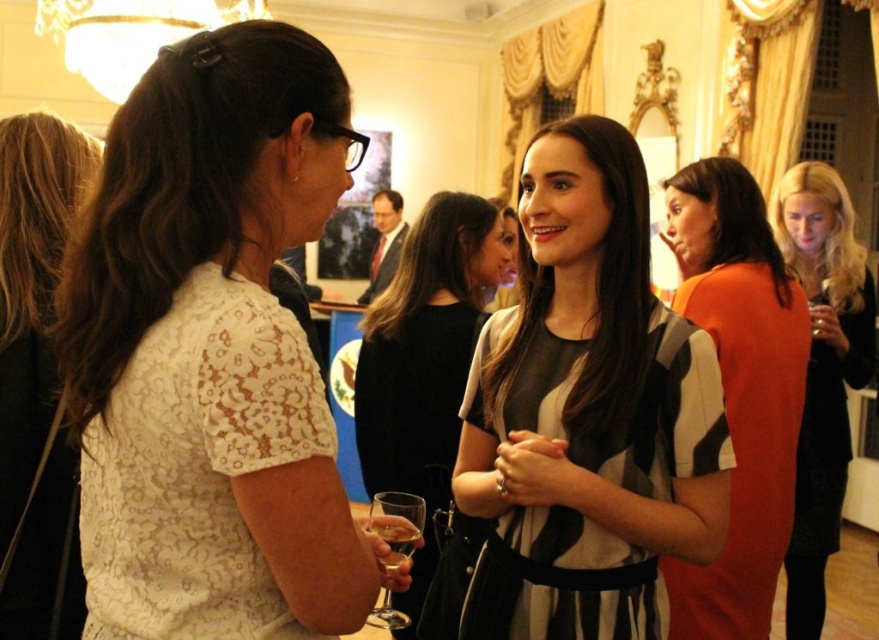
Question: Can you confirm if striped fabric dress at center is wider than black velvet dress at right?

Choices:
 (A) yes
 (B) no

Answer: (A)

Question: Estimate the real-world distances between objects in this image. Which object is closer to the striped fabric dress at center?

Choices:
 (A) black velvet dress at right
 (B) blonde hair at left
 (C) translucent glass at center

Answer: (B)

Question: Which point appears closest to the camera in this image?

Choices:
 (A) (764, 602)
 (B) (25, 444)
 (C) (409, 554)

Answer: (C)

Question: Can you confirm if orange matte dress at right is smaller than black velvet dress at right?

Choices:
 (A) yes
 (B) no

Answer: (B)

Question: Does blonde hair at left come behind clear glass wine glass at lower center?

Choices:
 (A) yes
 (B) no

Answer: (A)

Question: Among these objects, which one is farthest from the camera?

Choices:
 (A) orange matte dress at right
 (B) translucent glass at center
 (C) striped fabric dress at center
 (D) blonde hair at left

Answer: (C)